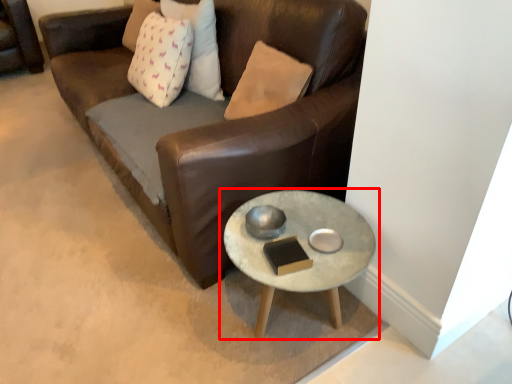
Question: Observing the image, what is the correct spatial positioning of coffee table (annotated by the red box) in reference to pillow?

Choices:
 (A) right
 (B) left

Answer: (A)